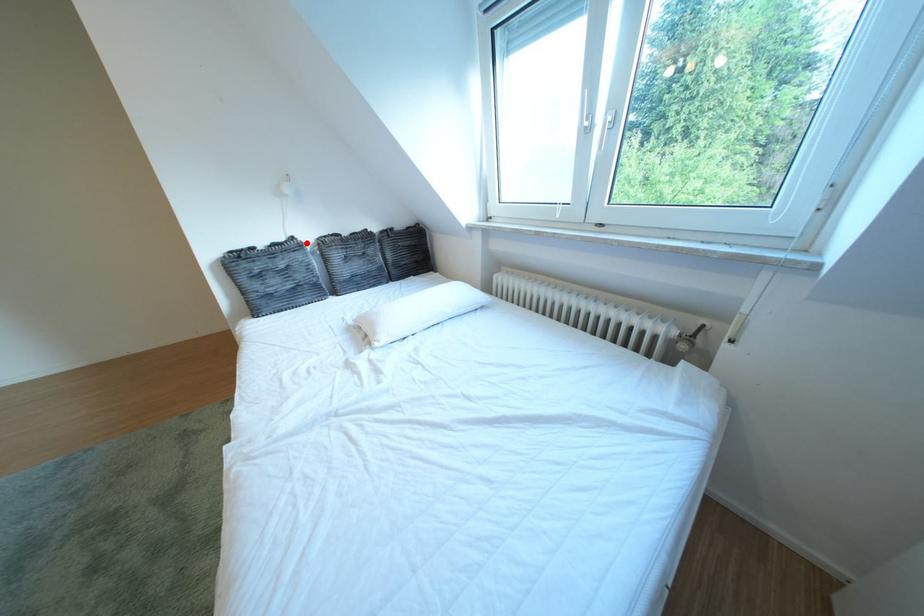
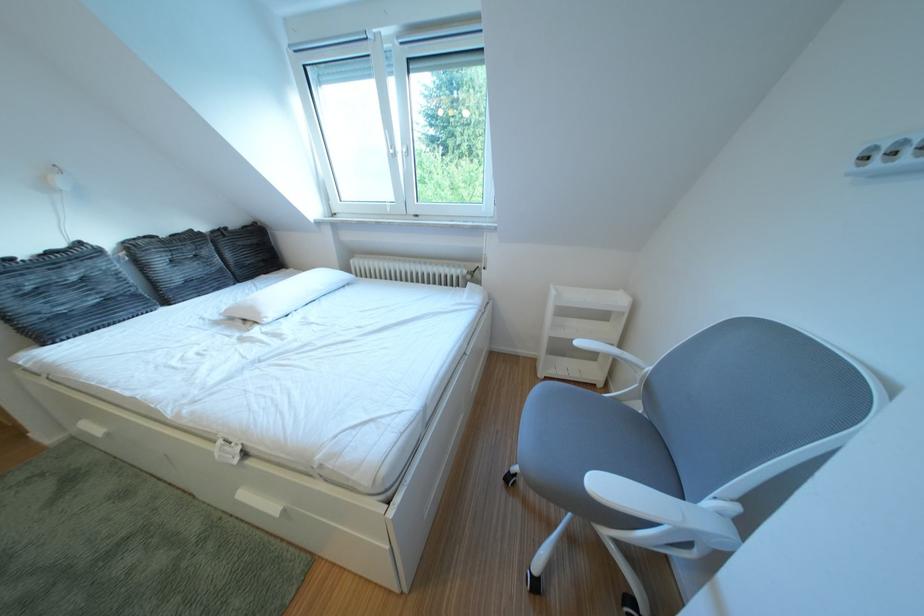
Question: A red point is marked in image1. In image2, is the corresponding 3D point closer to the camera or farther? Reply with the corresponding letter.

Choices:
 (A) The corresponding 3D point is closer.
 (B) The corresponding 3D point is farther.

Answer: (B)